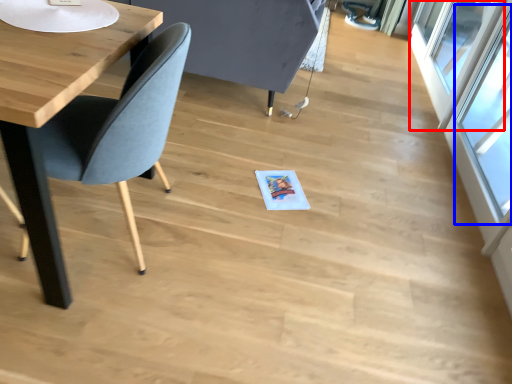
Question: Which object is closer to the camera taking this photo, window (highlighted by a red box) or window (highlighted by a blue box)?

Choices:
 (A) window
 (B) window

Answer: (B)